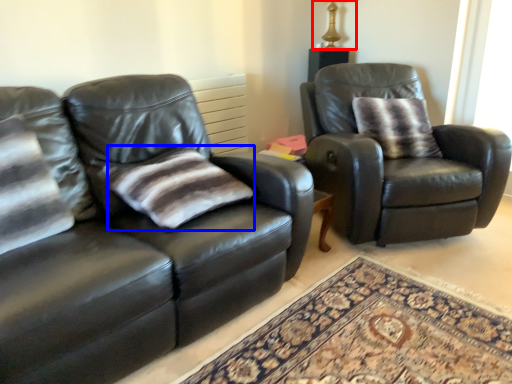
Question: Which of the following is the farthest to the observer, table lamp (highlighted by a red box) or pillow (highlighted by a blue box)?

Choices:
 (A) table lamp
 (B) pillow

Answer: (A)